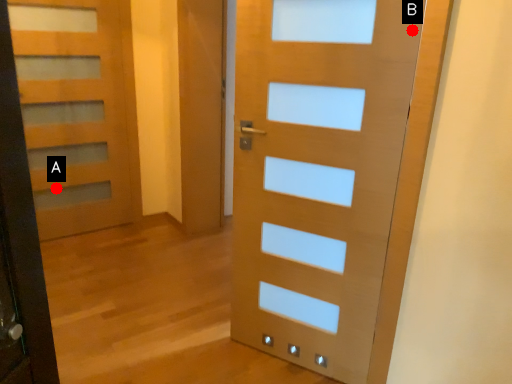
Question: Two points are circled on the image, labeled by A and B beside each circle. Among these points, which one is farthest from the camera?

Choices:
 (A) A is further
 (B) B is further

Answer: (A)